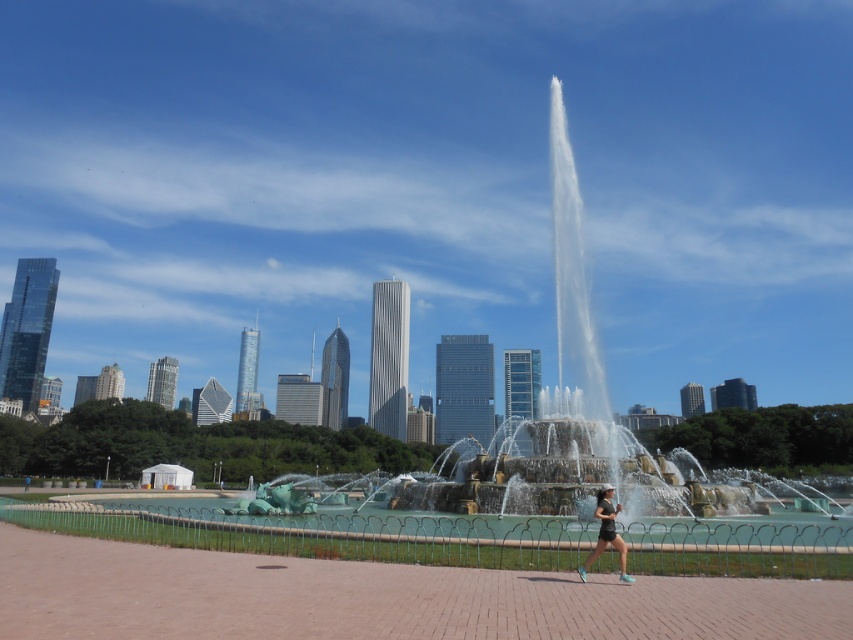
Question: Does green patina fountain at center have a greater width compared to matte black shorts at center?

Choices:
 (A) yes
 (B) no

Answer: (A)

Question: Which point is farther to the camera?

Choices:
 (A) matte black shorts at center
 (B) green patina fountain at center

Answer: (B)

Question: From the image, what is the correct spatial relationship of green patina fountain at center in relation to matte black shorts at center?

Choices:
 (A) right
 (B) left

Answer: (B)

Question: Does green patina fountain at center come behind matte black shorts at center?

Choices:
 (A) no
 (B) yes

Answer: (B)

Question: Which object appears farthest from the camera in this image?

Choices:
 (A) green patina fountain at center
 (B) matte black shorts at center

Answer: (A)

Question: Which point appears farthest from the camera in this image?

Choices:
 (A) (601, 548)
 (B) (595, 353)

Answer: (B)